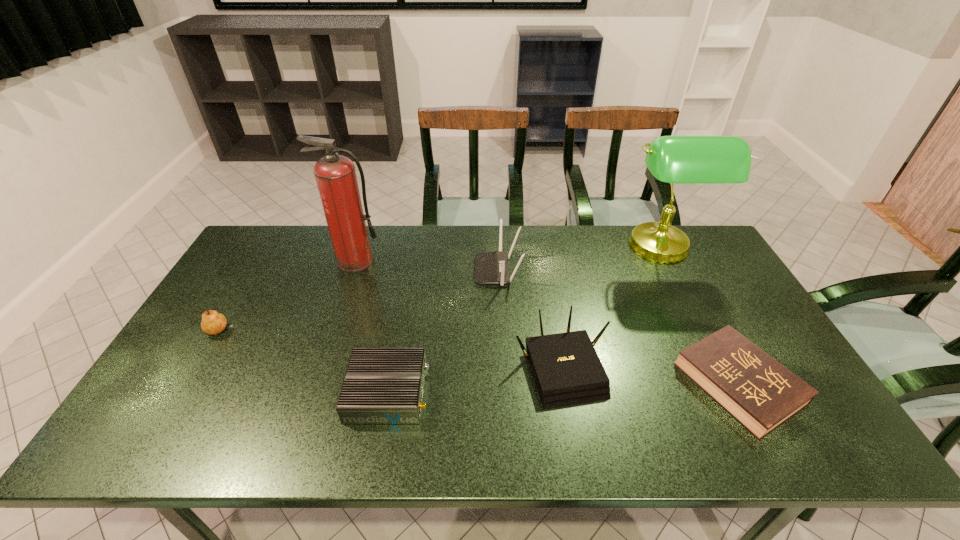
Where is `vacant region located 0.070m at the nozzle of the fire extinguisher`? The width and height of the screenshot is (960, 540). vacant region located 0.070m at the nozzle of the fire extinguisher is located at coordinates (348, 287).

Locate an element on the screen. The width and height of the screenshot is (960, 540). free space located 0.310m on the desk next to the lamp is located at coordinates (527, 249).

At what (x,y) coordinates should I click in order to perform the action: click on vacant area located 0.360m on the desk next to the lamp. Please return your answer as a coordinate pair (x, y). This screenshot has height=540, width=960. Looking at the image, I should click on (513, 249).

This screenshot has width=960, height=540. Find the location of `free space located 0.310m on the desk next to the lamp`. free space located 0.310m on the desk next to the lamp is located at coordinates (527, 249).

Locate an element on the screen. This screenshot has width=960, height=540. free location located 0.150m on the front-facing side of the third tallest object is located at coordinates (429, 271).

Where is `vacant space located on the front-facing side of the third tallest object`? The image size is (960, 540). vacant space located on the front-facing side of the third tallest object is located at coordinates (401, 271).

The height and width of the screenshot is (540, 960). I want to click on free space located on the front-facing side of the third tallest object, so click(x=404, y=271).

At what (x,y) coordinates should I click in order to perform the action: click on vacant area situated on the back of the second shortest router. Please return your answer as a coordinate pair (x, y). Image resolution: width=960 pixels, height=540 pixels. Looking at the image, I should click on (547, 280).

Where is `free space located on the front of the fifth tallest object`? The width and height of the screenshot is (960, 540). free space located on the front of the fifth tallest object is located at coordinates (197, 375).

In order to click on vacant position located on the back panel of the leftmost router in this screenshot , I will do `click(572, 392)`.